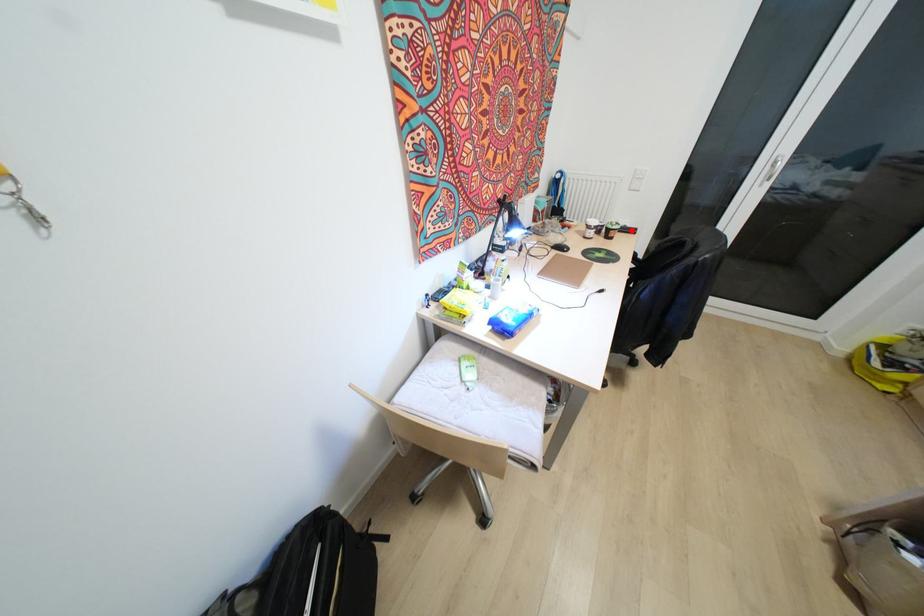
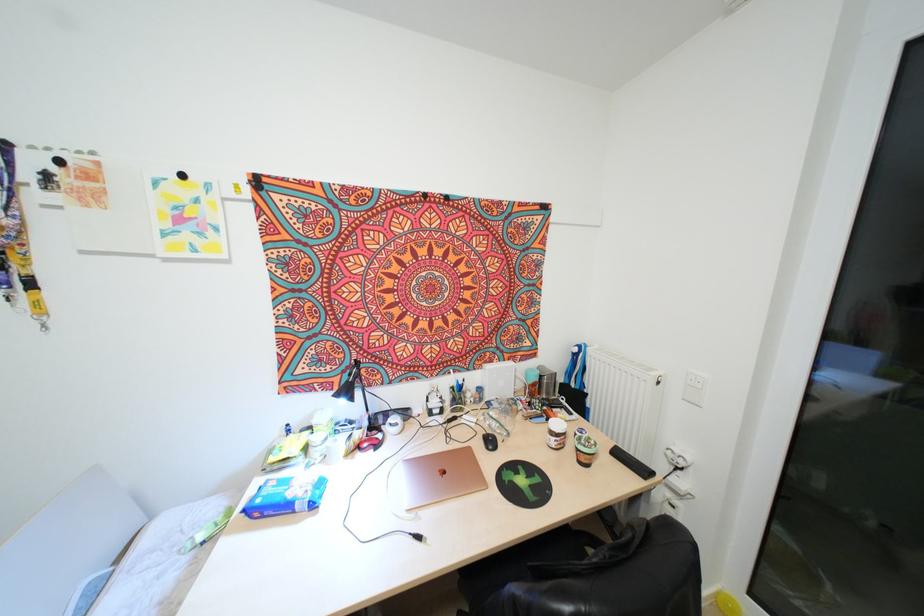
The point at the highlighted location is marked in the first image. Where is the corresponding point in the second image?

(642, 471)